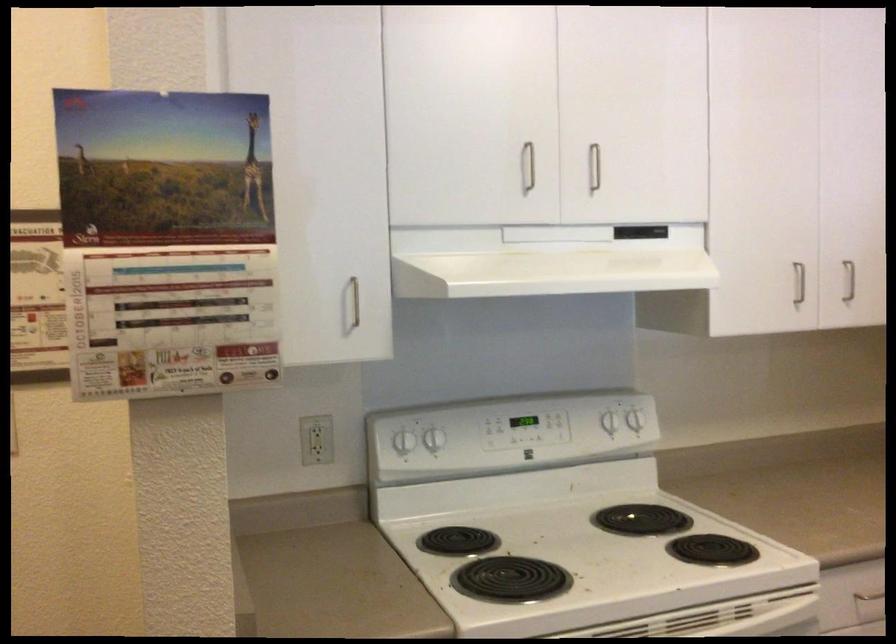
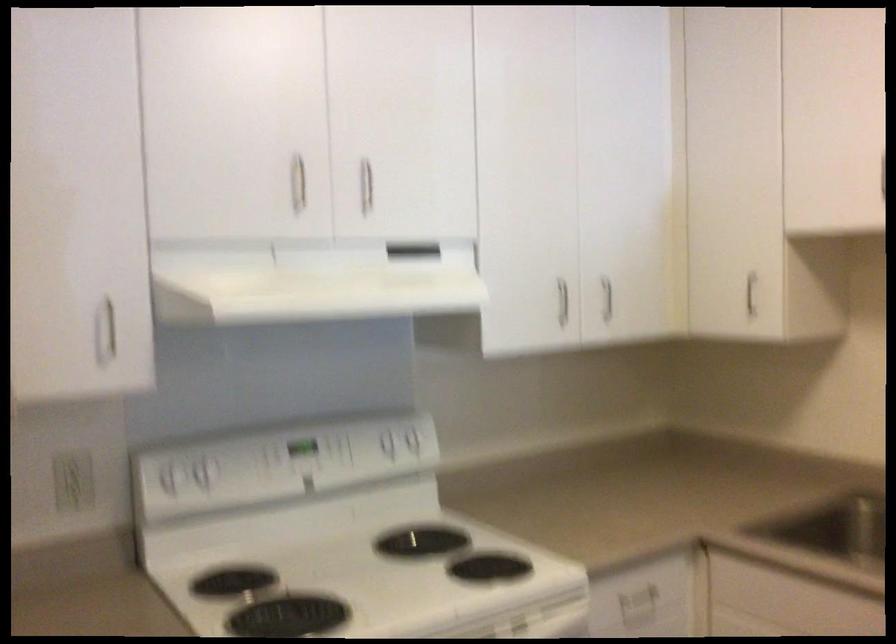
Find the pixel in the second image that matches pixel 429 440 in the first image.

(200, 474)